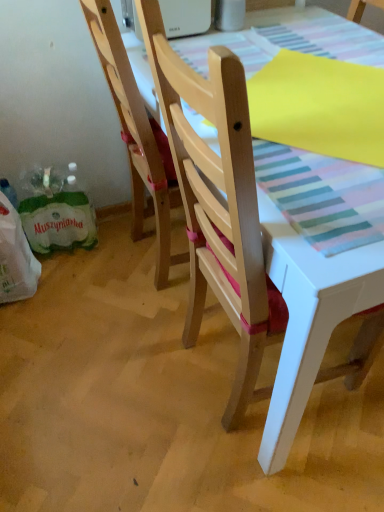
Locate an element on the screen. Image resolution: width=384 pixels, height=512 pixels. vacant space that is in between wooden chair at center, acting as the first chair starting from the right, and green plastic grocery bag at lower left is located at coordinates (108, 329).